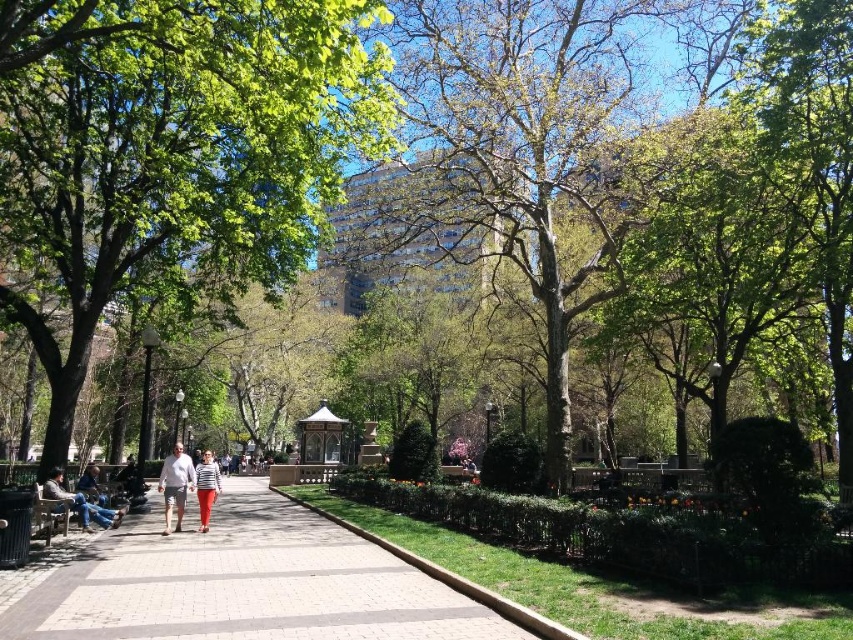
In the scene shown: You are a photographer setting up a camera on a tripod in the park. You need to position the camera so that both the light gray shorts at center and the denim pants at left are in frame. Which object should you place closer to the camera to ensure they both fit in the shot?

The light gray shorts at center might be wider than denim pants at left, so you should place the camera closer to the light gray shorts at center to ensure both fit in the shot.

You are a photographer standing at the entrance of the park. You want to take a photo of both the light gray shorts at center and denim pants at left so that both are clearly visible in the frame. Given their positions, which one should you focus on first to ensure both are in focus?

You should focus on the light gray shorts at center first because the denim pants at left is behind it. By focusing on the closer object, the depth of field may allow both to be in focus.

You are a park visitor who wants to take a photo of the green leafy tree at center and the smooth concrete path at center. Which object should you focus on first if you want to capture both in one frame without moving the camera?

The green leafy tree at center is located above the smooth concrete path at center, so you should focus on the green leafy tree at center first to ensure both are in focus since it is closer to the camera.